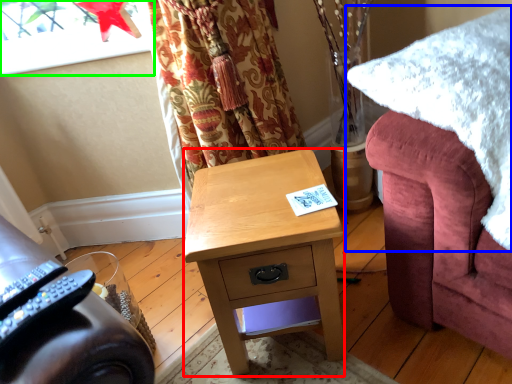
Question: Which object is the closest to the desk (highlighted by a red box)? Choose among these: blanket (highlighted by a blue box) or window screen (highlighted by a green box).

Choices:
 (A) blanket
 (B) window screen

Answer: (A)